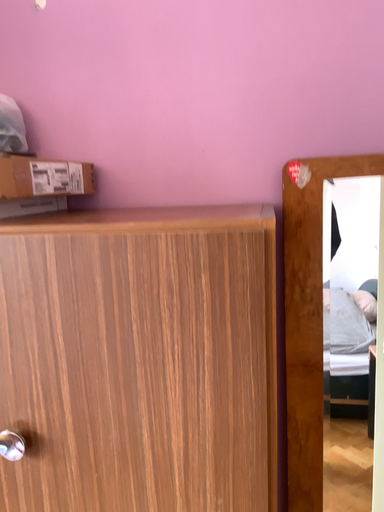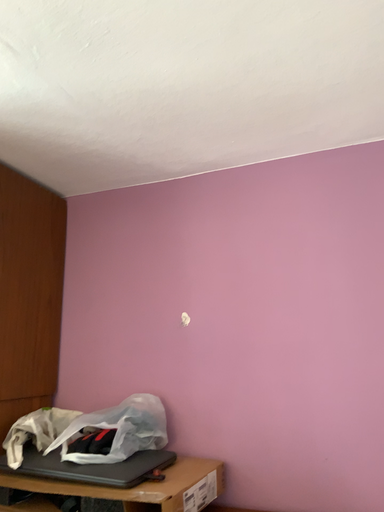
Question: Which way did the camera rotate in the video?

Choices:
 (A) rotated right
 (B) rotated left

Answer: (B)